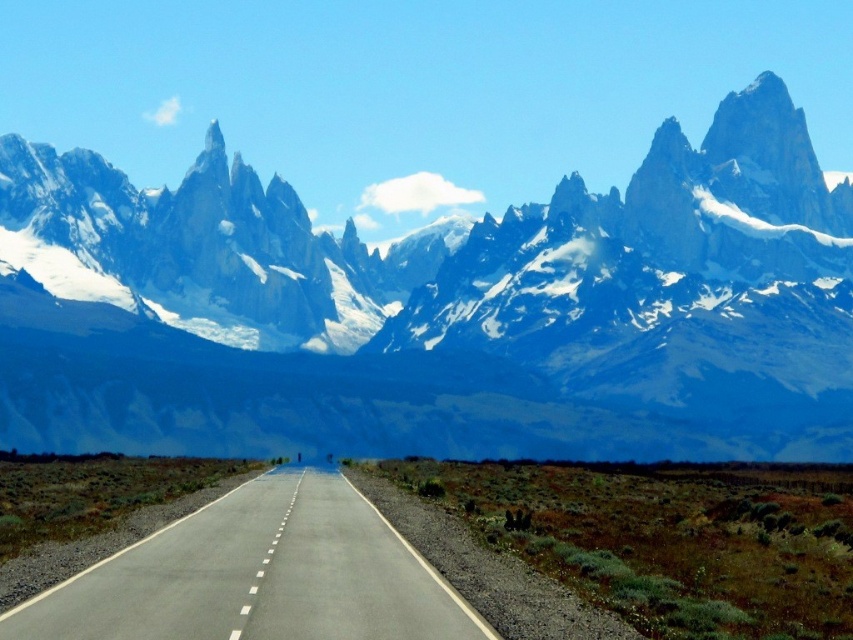
You are a hiker planning to take a photo of the snowy granite mountain range at upper center from the road. Given that the road is at point 0.486 on the horizontal axis, can you estimate whether the mountain range is positioned to the left or right of the road?

The snowy granite mountain range at upper center is located at point 0.486 on the horizontal axis, which aligns with the road. Therefore, the mountain range is directly centered above the road.

You are a hiker planning to take a photo of the snowy granite mountain range at upper center and the asphalt road at center. Which object will appear larger in your photo?

The snowy granite mountain range at upper center will appear larger in the photo because it has a larger size compared to the asphalt road at center.